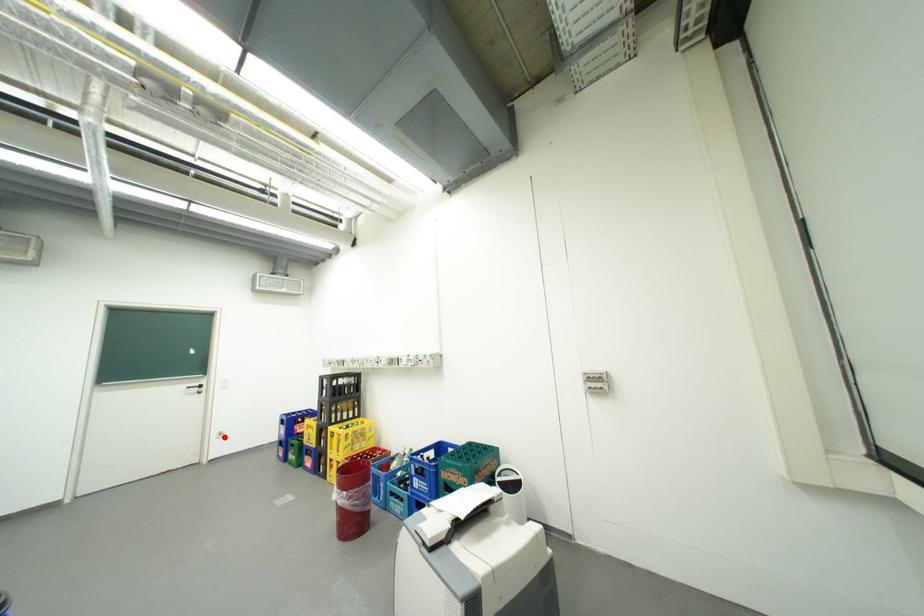
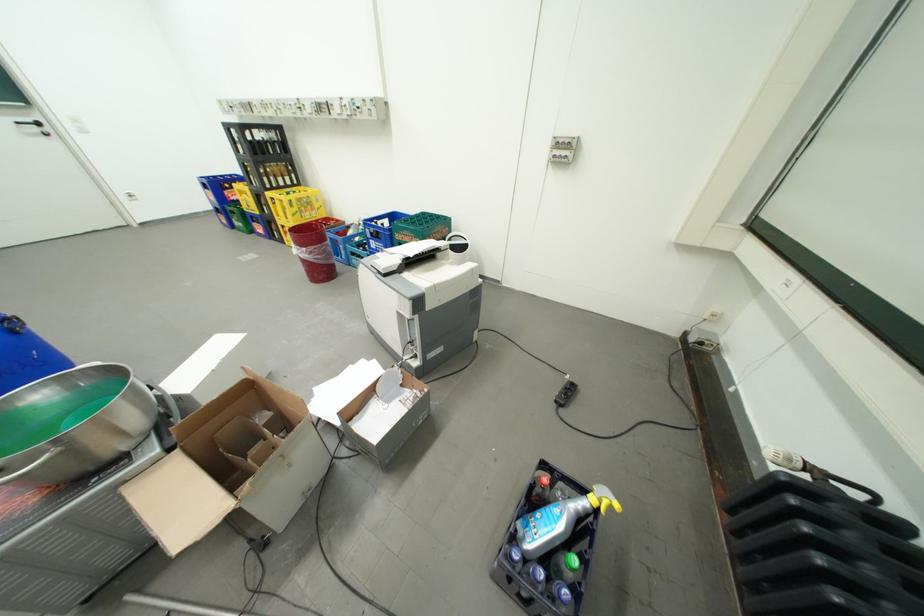
Locate, in the second image, the point that corresponds to the highlighted location in the first image.

(134, 199)